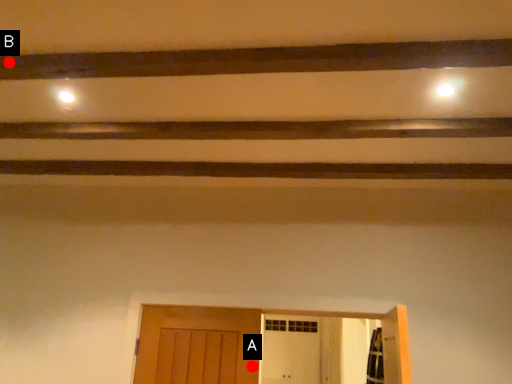
Question: Two points are circled on the image, labeled by A and B beside each circle. Which point is closer to the camera?

Choices:
 (A) A is closer
 (B) B is closer

Answer: (B)